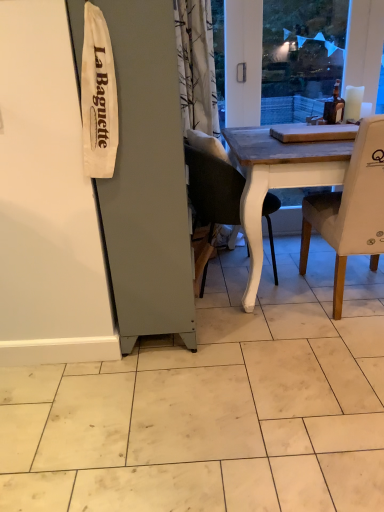
Locate an element on the screen. This screenshot has height=512, width=384. vacant space positioned to the left of white fabric chair at right, acting as the first chair starting from the right is located at coordinates (266, 318).